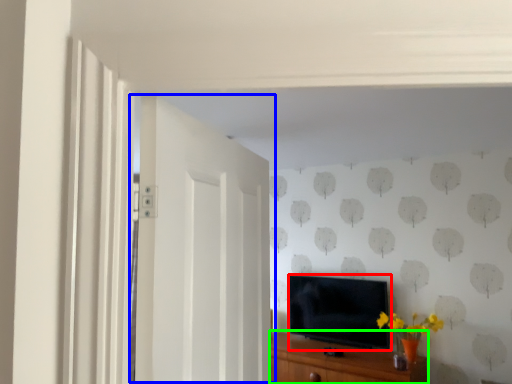
Question: Which is nearer to the television (highlighted by a red box)? door (highlighted by a blue box) or cabinetry (highlighted by a green box).

Choices:
 (A) door
 (B) cabinetry

Answer: (B)